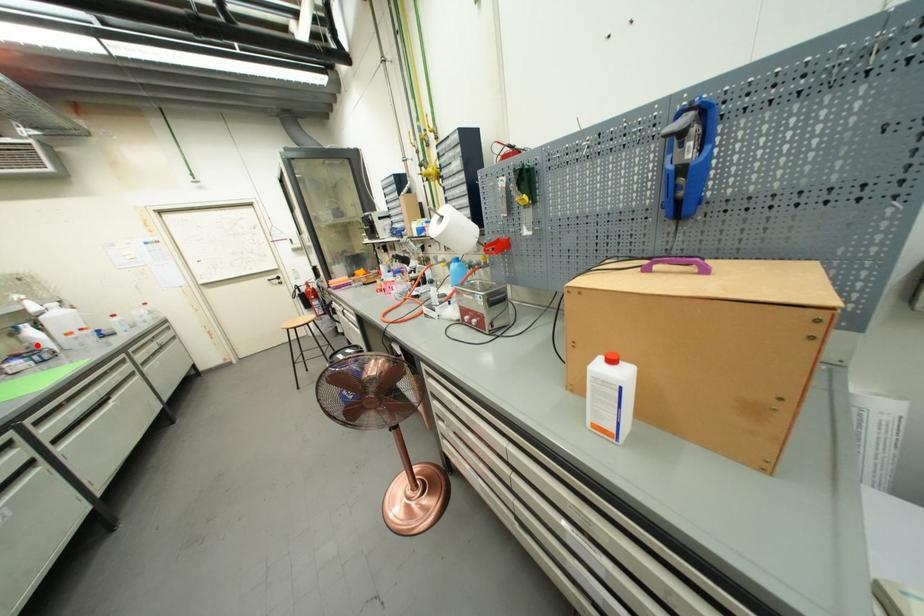
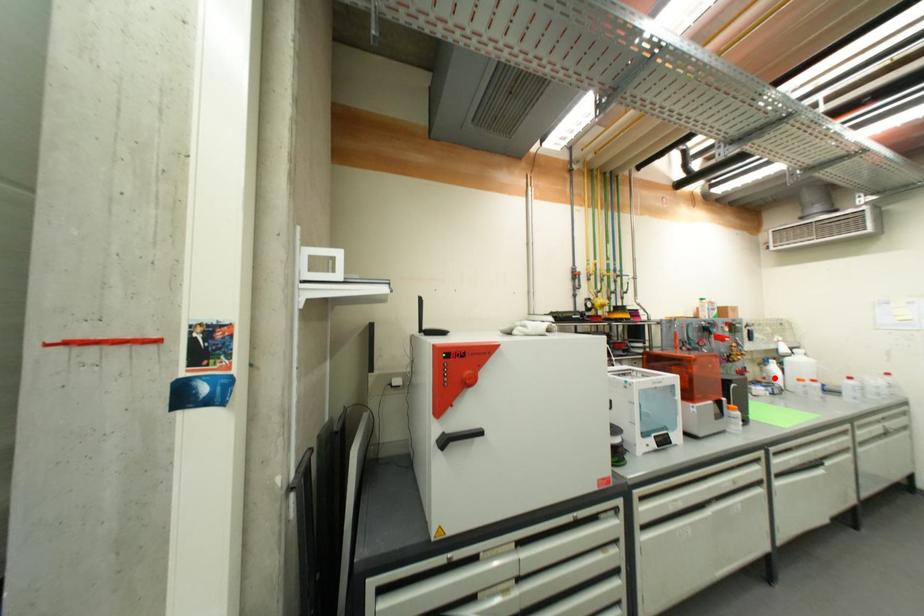
I am providing you with two images of the same scene from different viewpoints. A red point is marked on the first image and another point is marked on the second image. Does the point marked in image1 correspond to the same location as the one in image2?

Yes